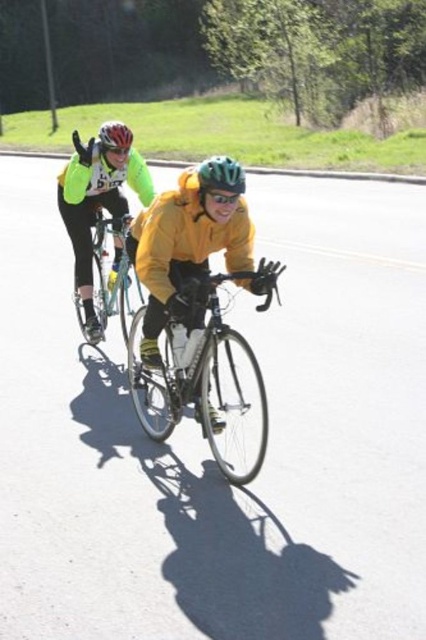
Question: Does yellow matte jacket at center have a larger size compared to matte red bicycle helmet at upper left?

Choices:
 (A) yes
 (B) no

Answer: (B)

Question: Which point is farther to the camera?

Choices:
 (A) (213, 161)
 (B) (253, 282)
 (C) (86, 262)

Answer: (C)

Question: Which point is farther to the camera?

Choices:
 (A) green matte bicycle helmet at center
 (B) matte red bicycle helmet at upper left

Answer: (B)

Question: Does neon yellow jersey at left appear under green matte bicycle helmet at center?

Choices:
 (A) no
 (B) yes

Answer: (B)

Question: Among these objects, which one is nearest to the camera?

Choices:
 (A) green matte bicycle helmet at center
 (B) matte red bicycle helmet at upper left
 (C) neon yellow jersey at left

Answer: (A)

Question: Considering the relative positions of yellow matte jacket at center and shiny metallic bicycle at center in the image provided, where is yellow matte jacket at center located with respect to shiny metallic bicycle at center?

Choices:
 (A) left
 (B) right

Answer: (A)